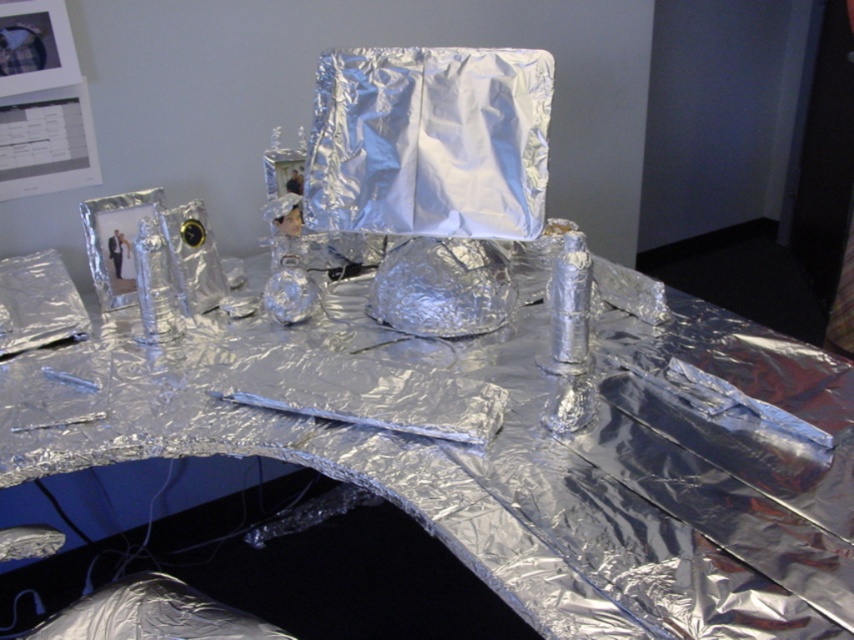
Is shiny metallic table at center further to the viewer compared to shiny metallic wrap at center?

No, shiny metallic table at center is in front of shiny metallic wrap at center.

Does point (390, 332) come farther from viewer compared to point (500, 74)?

Yes, it is.

Who is more distant from viewer, (531, 321) or (413, 163)?

The point (531, 321) is more distant.

Locate an element on the screen. shiny metallic table at center is located at coordinates pos(518,464).